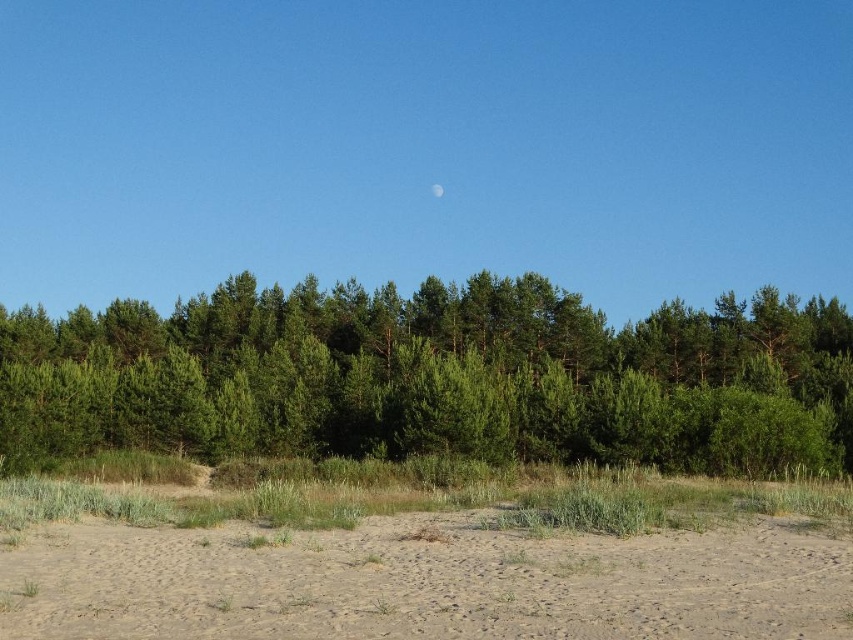
Does brown sandy dirt at lower center have a greater height compared to white glossy moon at upper center?

No.

Which is more to the left, brown sandy dirt at lower center or white glossy moon at upper center?

white glossy moon at upper center is more to the left.

I want to click on brown sandy dirt at lower center, so click(x=424, y=582).

Between point (242, 308) and point (437, 189), which one is positioned in front?

Positioned in front is point (242, 308).

Between green leafy forest at center and white glossy moon at upper center, which one is positioned higher?

white glossy moon at upper center is above.

Which is behind, point (447, 435) or point (434, 195)?

The point (434, 195) is more distant.

Where is `green leafy forest at center`? green leafy forest at center is located at coordinates (434, 378).

Is point (679, 394) in front of point (293, 611)?

No, it is not.

Does green leafy forest at center have a smaller size compared to brown sandy dirt at lower center?

Actually, green leafy forest at center might be larger than brown sandy dirt at lower center.

Identify the location of green leafy forest at center. This screenshot has width=853, height=640. coord(434,378).

Image resolution: width=853 pixels, height=640 pixels. I want to click on green leafy forest at center, so 434,378.